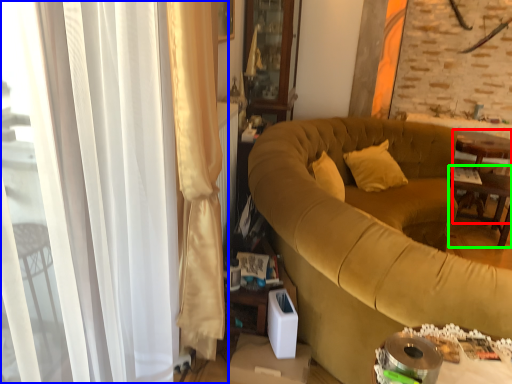
Question: Based on their relative distances, which object is farther from table (highlighted by a red box)? Choose from curtain (highlighted by a blue box) and table (highlighted by a green box).

Choices:
 (A) curtain
 (B) table

Answer: (A)